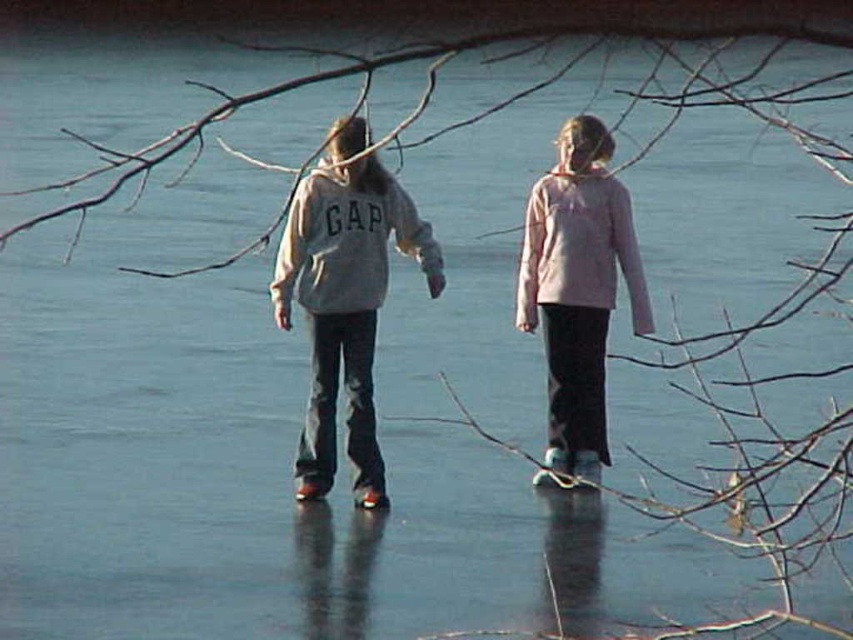
Question: Does pink fabric jacket at center appear on the right side of light gray fleece sweatshirt at center?

Choices:
 (A) yes
 (B) no

Answer: (A)

Question: Which object is closer to the camera taking this photo?

Choices:
 (A) pink fleece sweatshirt at center
 (B) pink fabric jacket at center
 (C) gray cotton hoodie at center
 (D) white cotton hoodie at center

Answer: (C)

Question: Is pink fabric jacket at center below light gray fleece sweatshirt at center?

Choices:
 (A) no
 (B) yes

Answer: (B)

Question: Which of the following is the closest to the observer?

Choices:
 (A) (590, 241)
 (B) (332, 188)

Answer: (B)

Question: Is gray cotton hoodie at center smaller than light gray fleece sweatshirt at center?

Choices:
 (A) yes
 (B) no

Answer: (B)

Question: Which point is closer to the camera?

Choices:
 (A) 343,182
 (B) 367,193

Answer: (B)